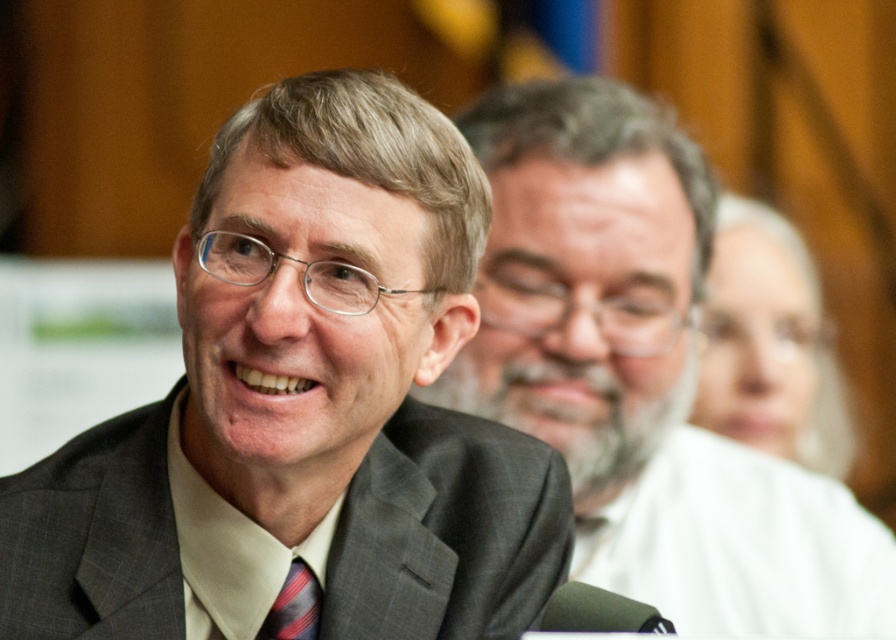
You are a photographer at a formal event. You want to adjust the camera focus to capture both the dark gray textured suit at center and the striped fabric tie at center clearly. Which object should you focus on first to ensure the other remains in focus?

The dark gray textured suit at center is in front of the striped fabric tie at center. To ensure both are in focus, you should focus on the dark gray textured suit at center first, as it is closer to the camera. This will keep the striped fabric tie at center within the depth of field.

You are a fashion designer observing the image and need to determine which item is wider between the matte gray suit at center and the striped fabric tie at center. Which one is wider?

The matte gray suit at center is wider than the striped fabric tie at center according to the description.